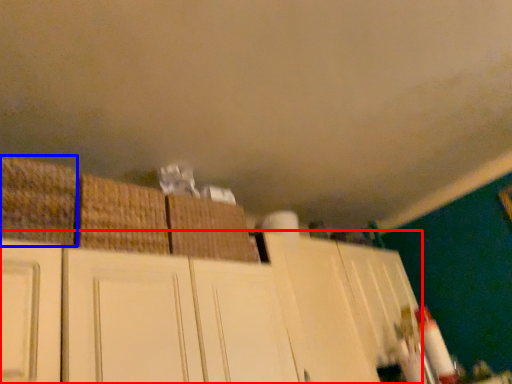
Question: Which object appears closest to the camera in this image, cabinetry (highlighted by a red box) or basket (highlighted by a blue box)?

Choices:
 (A) cabinetry
 (B) basket

Answer: (A)